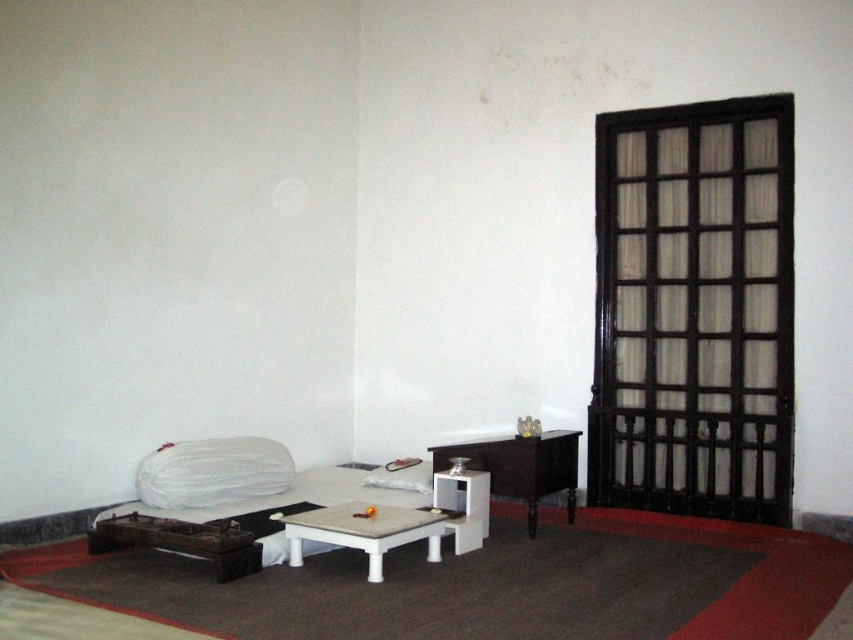
You are standing in the middle of the room and see the matte black table at center and the white glossy table at center. Which table is closer to the right wall?

The matte black table at center is positioned on the right side of the white glossy table at center, so it is closer to the right wall.

You are a delivery person who needs to place a package on the higher table in the room. Which table should you choose between the matte black table at center and the white glossy table at center?

The matte black table at center is taller than the white glossy table at center, so you should choose the matte black table at center to place the package.

You are a delivery person trying to place a small package between the white fabric bed at lower left and the white matte pillow at center. The package is 30 inches long. Can you fit it in the space between them?

The distance between the white fabric bed at lower left and the white matte pillow at center is 27.04 inches. Since the package is 30 inches long, it cannot fit in the space between them.